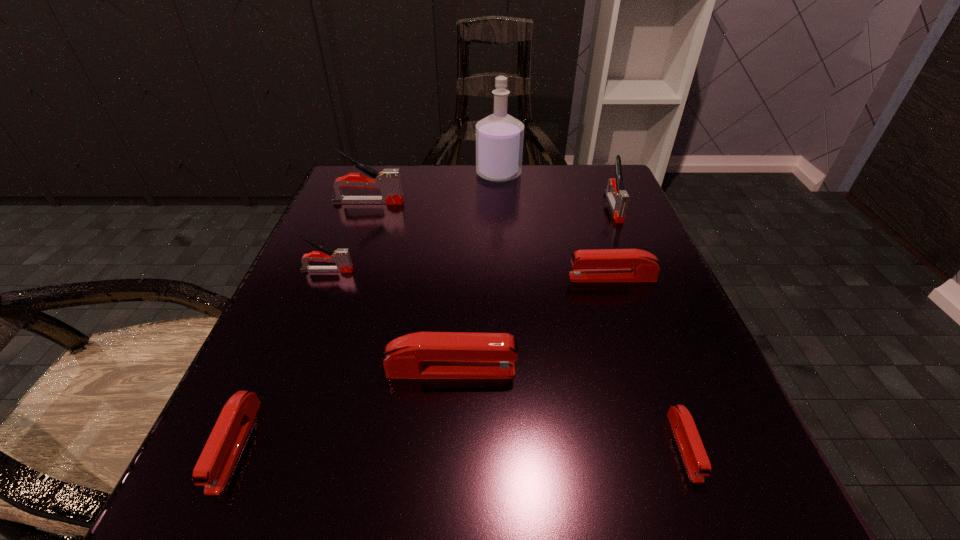
You are a GUI agent. You are given a task and a screenshot of the screen. Output one action in this format:
    pyautogui.click(x=<x>, y=<y>)
    Task: Click on the closest gray stapler to the sixth tallest object
    Image resolution: width=960 pixels, height=540 pixels.
    Given the screenshot: What is the action you would take?
    pyautogui.click(x=618, y=198)

This screenshot has height=540, width=960. Identify the location of red stapler that is the second nearest to the biggest red stapler. (691, 447).

In order to click on the fourth closest red stapler to the nearest gray stapler in this screenshot , I will do `click(691, 447)`.

Image resolution: width=960 pixels, height=540 pixels. In order to click on free space in the image that satisfies the following two spatial constraints: 1. on the front side of the perfume; 2. on the front-facing side of the fourth stapler from left to right in this screenshot , I will do `click(512, 370)`.

I want to click on free space that satisfies the following two spatial constraints: 1. on the front side of the perfume; 2. on the front-facing side of the fifth farthest stapler, so tap(512, 370).

At what (x,y) coordinates should I click in order to perform the action: click on vacant space that satisfies the following two spatial constraints: 1. on the handle side of the second tallest stapler; 2. on the front-facing side of the second farthest red stapler. Please return your answer as a coordinate pair (x, y). This screenshot has height=540, width=960. Looking at the image, I should click on (683, 370).